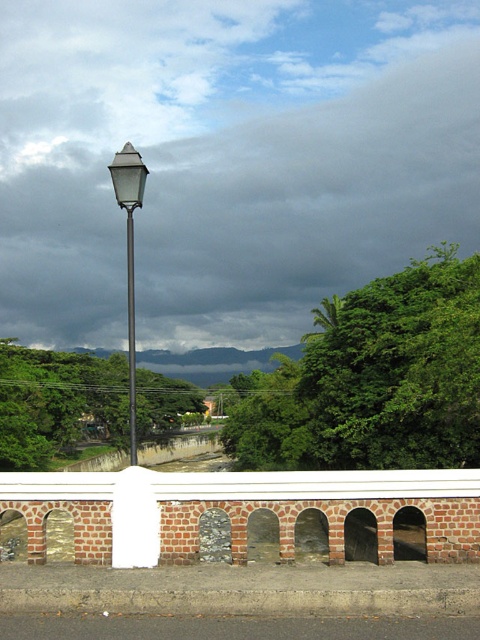
Question: From the image, what is the correct spatial relationship of green leafy tree at upper center in relation to green leafy tree at center?

Choices:
 (A) above
 (B) below

Answer: (A)

Question: Which point is closer to the camera?

Choices:
 (A) (133, 161)
 (B) (326, 356)

Answer: (A)

Question: Estimate the real-world distances between objects in this image. Which object is farther from the matte metal pole at center?

Choices:
 (A) green leafy tree at center
 (B) metallic streetlight at center
 (C) green leafy tree at upper center

Answer: (C)

Question: Does metallic streetlight at center come in front of matte metal pole at center?

Choices:
 (A) no
 (B) yes

Answer: (B)

Question: Which object is closer to the camera taking this photo?

Choices:
 (A) metallic streetlight at center
 (B) green leafy tree at center

Answer: (A)

Question: Is green leafy tree at center smaller than metallic streetlight at center?

Choices:
 (A) yes
 (B) no

Answer: (A)